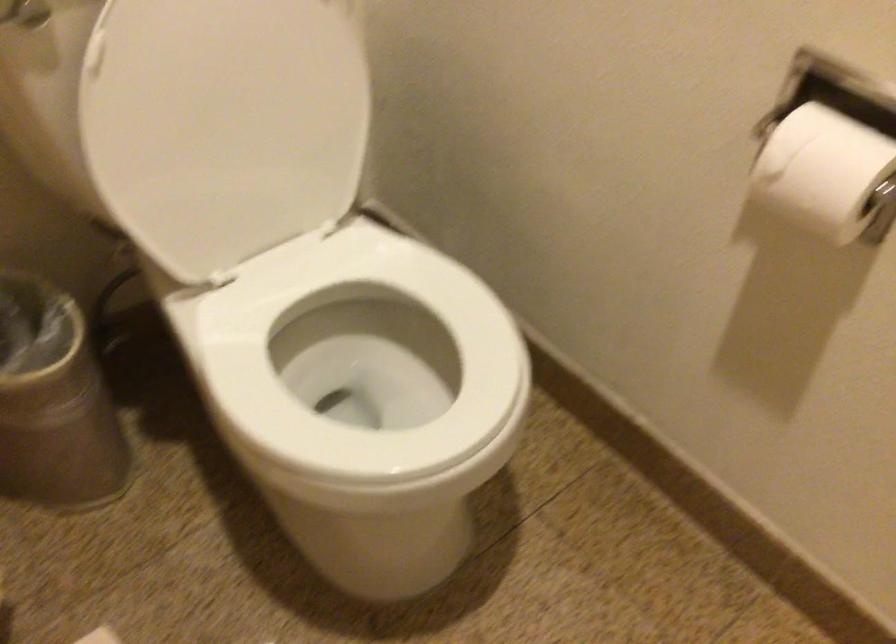
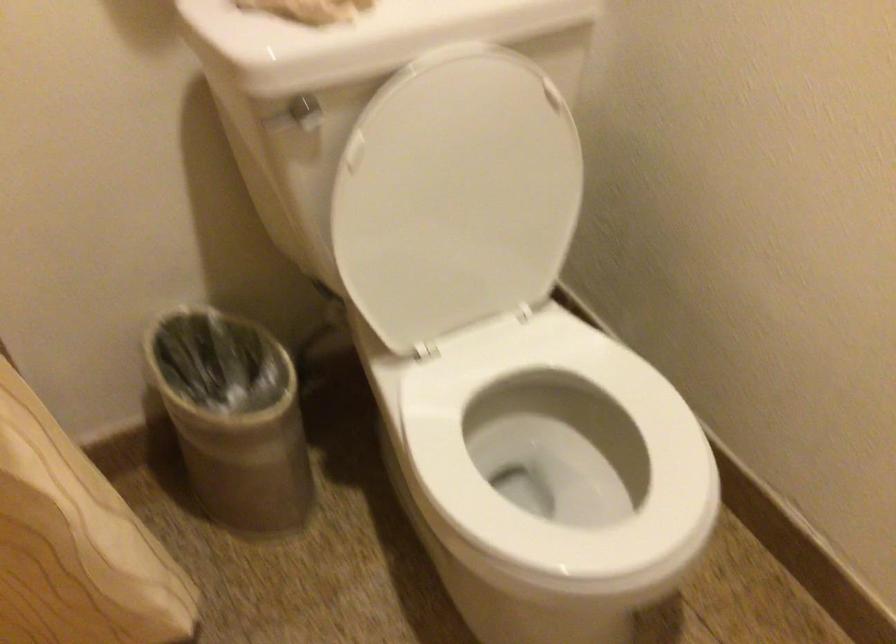
In a continuous first-person perspective shot, in which direction is the camera moving?

The cameraman walked toward left, backward.